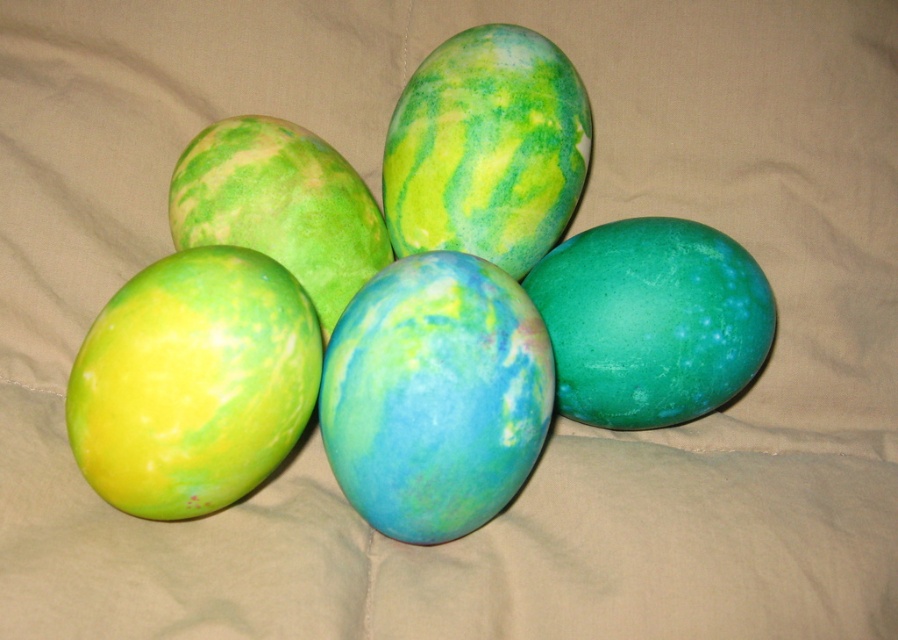
From the picture: Can you confirm if blue-green marble egg at center is positioned above green matte egg at center?

Actually, blue-green marble egg at center is below green matte egg at center.

Who is taller, blue-green marble egg at center or green matte egg at center?

Standing taller between the two is blue-green marble egg at center.

Is point (376, 461) closer to camera compared to point (568, 381)?

Yes, point (376, 461) is closer to viewer.

Where is `blue-green marble egg at center`? The height and width of the screenshot is (640, 898). blue-green marble egg at center is located at coordinates (436, 396).

Can you confirm if yellow-green marble egg at lower left is smaller than blue-green marble egg at center?

No.

Which is behind, point (199, 387) or point (439, 429)?

The point (439, 429) is behind.

Does point (93, 428) lie in front of point (401, 364)?

That is True.

Identify the location of yellow-green marble egg at lower left. The image size is (898, 640). (x=192, y=381).

Describe the element at coordinates (455, 337) in the screenshot. I see `matte green egg at center` at that location.

Between point (575, 355) and point (392, 172), which one is positioned behind?

Point (392, 172)

Looking at this image, measure the distance between matte green egg at center and camera.

1.04 meters

Identify the location of matte green egg at center. (455, 337).